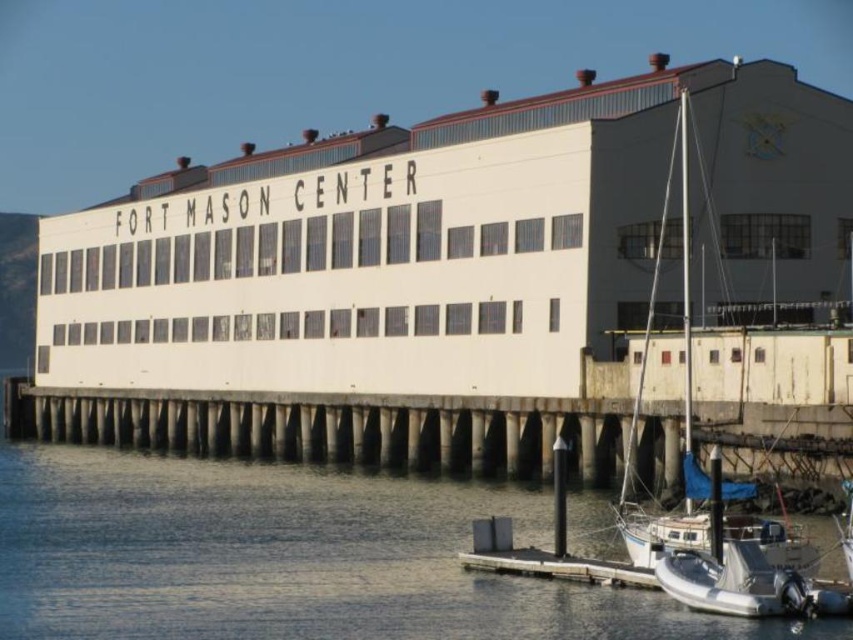
Consider the image. You are standing at the point closest to the water in the image and want to walk towards the building. Which of the two points, point (466, 413) or point (654, 296), will you encounter first?

You will encounter point (654, 296) first because it is closer to you than point (466, 413), which is further away.